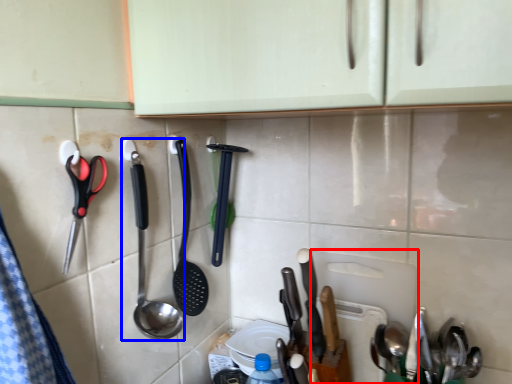
Question: Which object is further to the camera taking this photo, cutting board (highlighted by a red box) or spoon (highlighted by a blue box)?

Choices:
 (A) cutting board
 (B) spoon

Answer: (A)